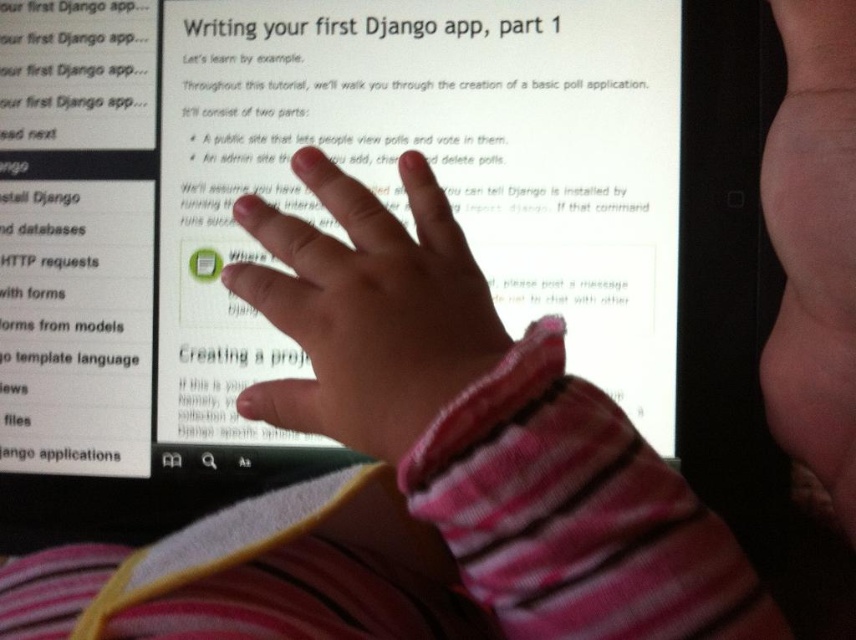
Is point (290, 228) in front of point (809, 401)?

Yes, it is.

At what (x,y) coordinates should I click in order to perform the action: click on pink fabric hand at center. Please return your answer as a coordinate pair (x, y). Looking at the image, I should click on (367, 308).